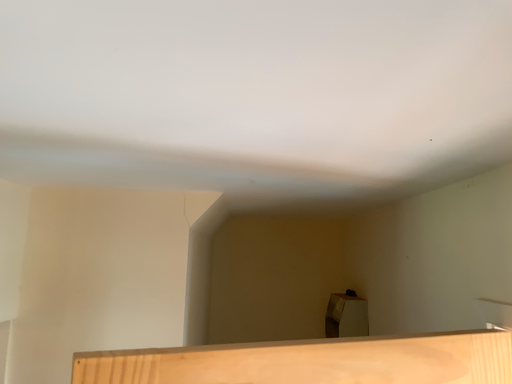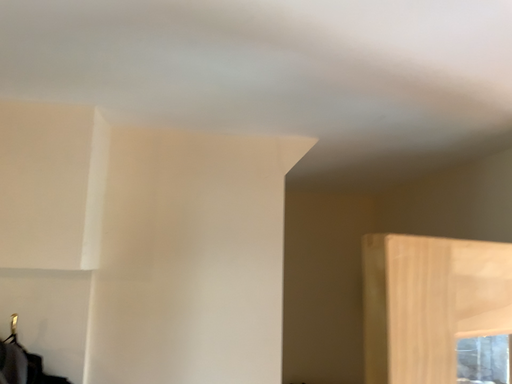
Question: How did the camera likely rotate when shooting the video?

Choices:
 (A) rotated left
 (B) rotated right

Answer: (B)